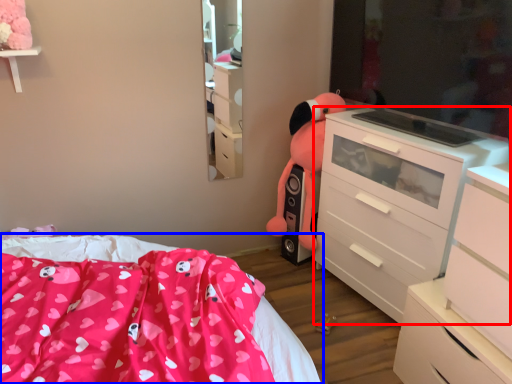
Question: Which object is closer to the camera taking this photo, chest of drawers (highlighted by a red box) or bed (highlighted by a blue box)?

Choices:
 (A) chest of drawers
 (B) bed

Answer: (B)